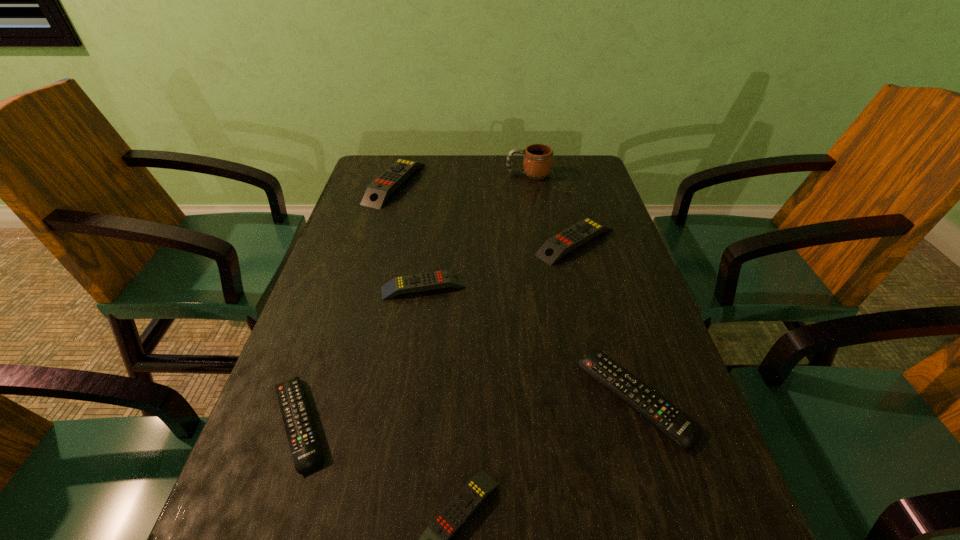
The width and height of the screenshot is (960, 540). In order to click on object at the far left corner in this screenshot , I will do `click(378, 191)`.

At what (x,y) coordinates should I click in order to perform the action: click on object that is positioned at the far right corner. Please return your answer as a coordinate pair (x, y). Image resolution: width=960 pixels, height=540 pixels. Looking at the image, I should click on (537, 158).

In the image, there is a desktop. In order to click on free space at the far edge in this screenshot , I will do `click(458, 176)`.

Find the location of `vacant space at the left edge of the desktop`. vacant space at the left edge of the desktop is located at coordinates (306, 349).

Find the location of a particular element. free space at the right edge of the desktop is located at coordinates (637, 369).

The width and height of the screenshot is (960, 540). I want to click on free space at the far left corner of the desktop, so click(x=364, y=179).

Identify the location of blank region between the tallest object and the biggest yellow remote control. The image size is (960, 540). (462, 179).

Locate an element on the screen. free point between the third nearest yellow remote control and the fourth farthest object is located at coordinates (499, 264).

This screenshot has width=960, height=540. I want to click on free spot between the second tallest object and the third farthest object, so click(x=485, y=212).

Locate an element on the screen. vacant point located between the second tallest remote control and the bigger black remote control is located at coordinates 604,320.